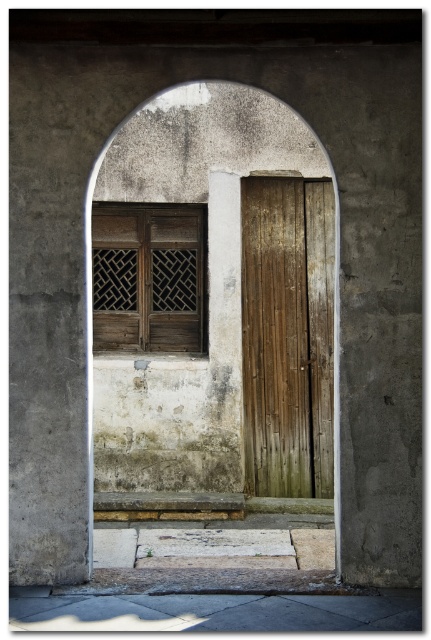
Question: Which object is farther from the camera taking this photo?

Choices:
 (A) weathered wood door at center
 (B) smooth concrete archway at center
 (C) gray concrete at lower center

Answer: (A)

Question: Does wooden lattice at center appear under gray concrete at lower center?

Choices:
 (A) no
 (B) yes

Answer: (A)

Question: Can you confirm if weathered wood door at center is bigger than gray concrete at lower center?

Choices:
 (A) no
 (B) yes

Answer: (B)

Question: Does smooth concrete archway at center have a larger size compared to weathered wood door at center?

Choices:
 (A) yes
 (B) no

Answer: (A)

Question: Which object is positioned closest to the wooden lattice at center?

Choices:
 (A) gray concrete at lower center
 (B) smooth concrete archway at center
 (C) weathered wood door at center

Answer: (B)

Question: Which of the following is the closest to the observer?

Choices:
 (A) (280, 600)
 (B) (321, 358)
 (C) (319, 182)
 (D) (112, 285)

Answer: (A)